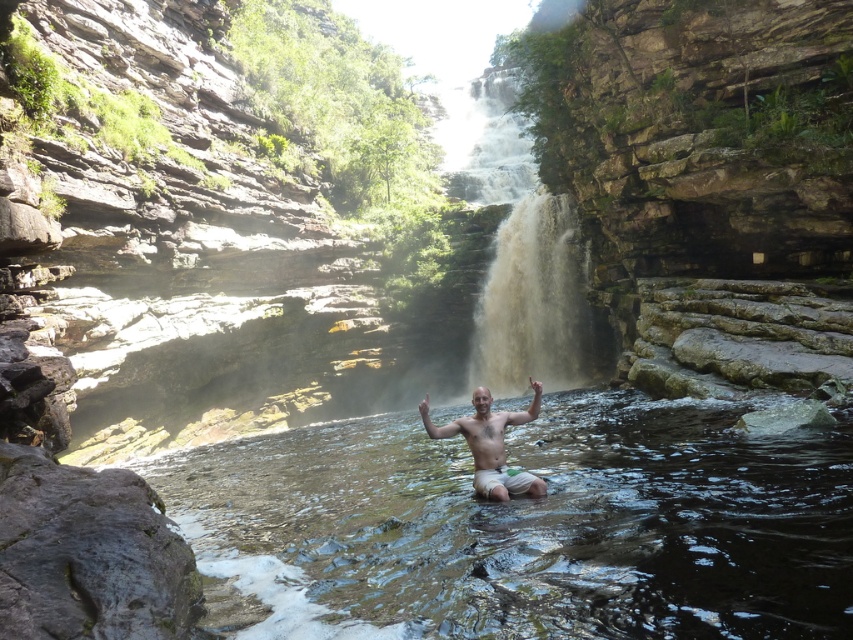
You are a photographer trying to capture the man and the waterfall in the same frame. Based on their positions, which direction should you move to ensure both the brown textured waterfall at center and the bare skin man at center are fully visible in your shot?

Since the brown textured waterfall at center is to the right of the bare skin man at center, you should move to the left to ensure both are fully visible in your frame.

You are a photographer planning to take a portrait of the bare skin man at center in the serene natural setting. Since the clear water at center is in front of him, will you need to adjust your camera focus to capture both the man and the water clearly?

The clear water at center is taller than the bare skin man at center, meaning the water is closer to the camera. To capture both clearly, you should focus on the water first since it is nearer, ensuring both subjects are in sharp focus.